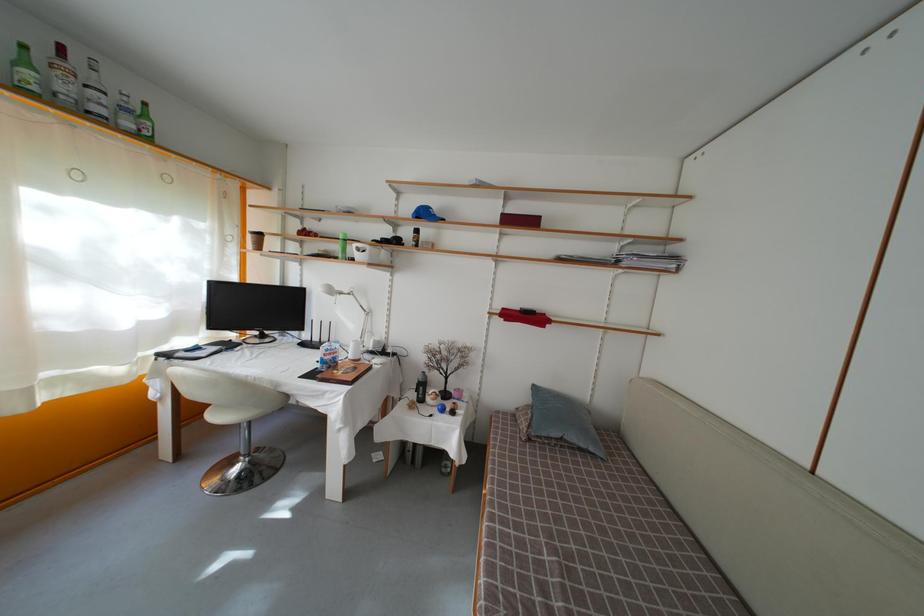
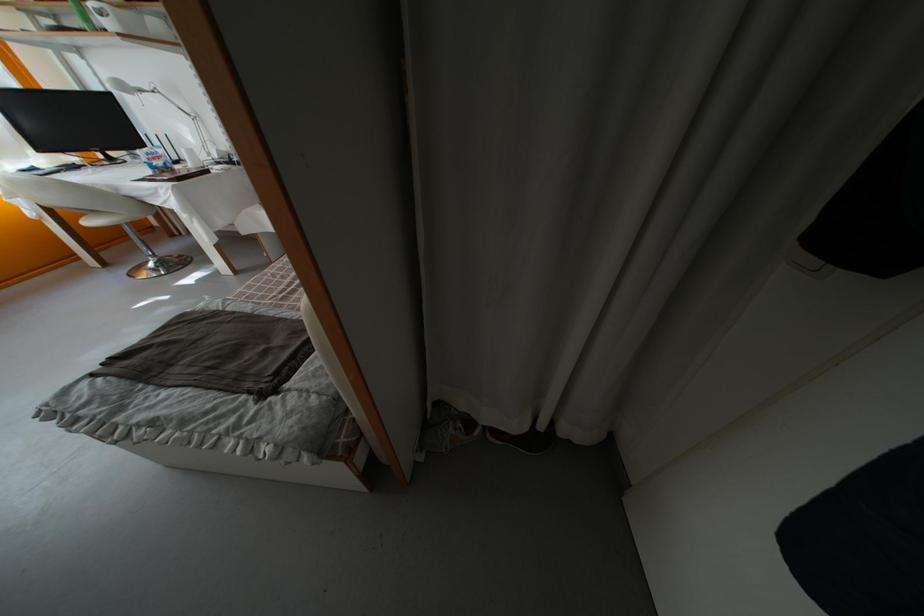
The point at (214, 410) is marked in the first image. Where is the corresponding point in the second image?

(84, 221)